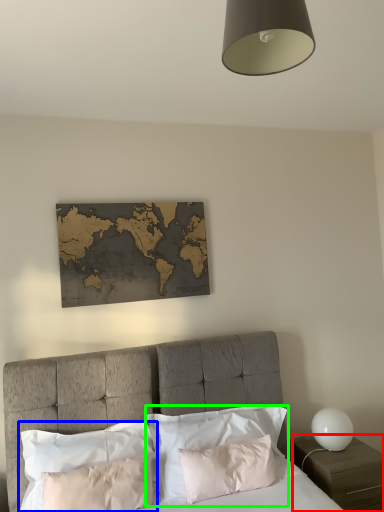
Question: Which object is positioned closest to nightstand (highlighted by a red box)? Select from pillow (highlighted by a blue box) and pillow (highlighted by a green box).

Choices:
 (A) pillow
 (B) pillow

Answer: (B)